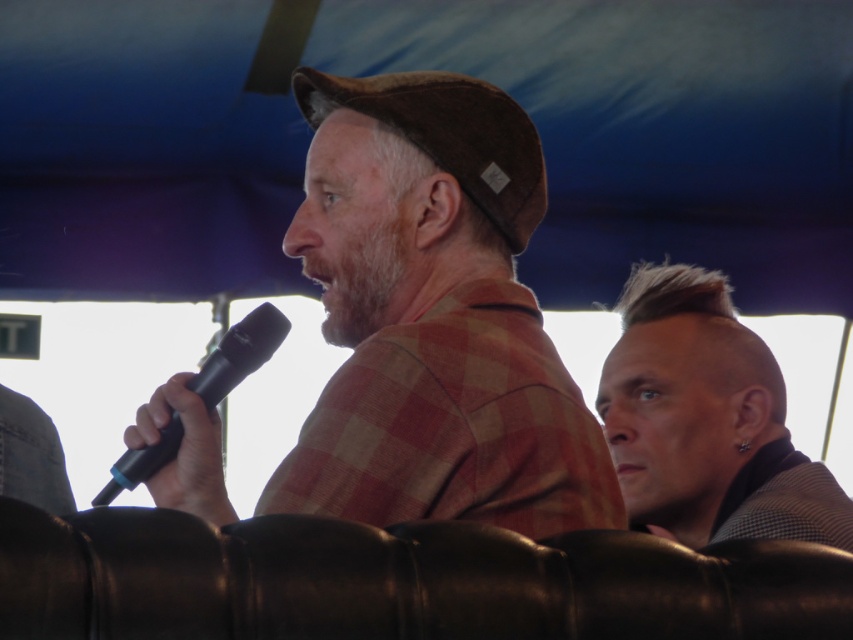
Question: Is brown woolen cap at center below black matte microphone at center?

Choices:
 (A) no
 (B) yes

Answer: (A)

Question: Can you confirm if brown woolen cap at center is thinner than black matte microphone at center?

Choices:
 (A) no
 (B) yes

Answer: (A)

Question: Is brown woolen cap at center in front of sleek silver hair at right?

Choices:
 (A) no
 (B) yes

Answer: (B)

Question: Estimate the real-world distances between objects in this image. Which object is closer to the sleek silver hair at right?

Choices:
 (A) black matte microphone at center
 (B) brown woolen cap at center

Answer: (B)

Question: Estimate the real-world distances between objects in this image. Which object is closer to the sleek silver hair at right?

Choices:
 (A) black matte microphone at center
 (B) brown woolen cap at center

Answer: (B)

Question: Among these points, which one is nearest to the camera?

Choices:
 (A) (238, 376)
 (B) (677, 442)

Answer: (A)